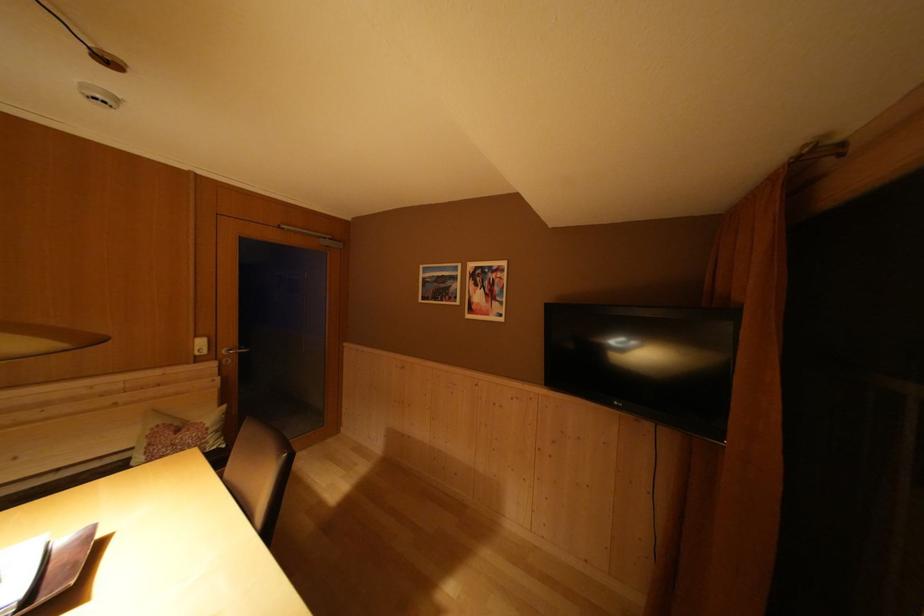
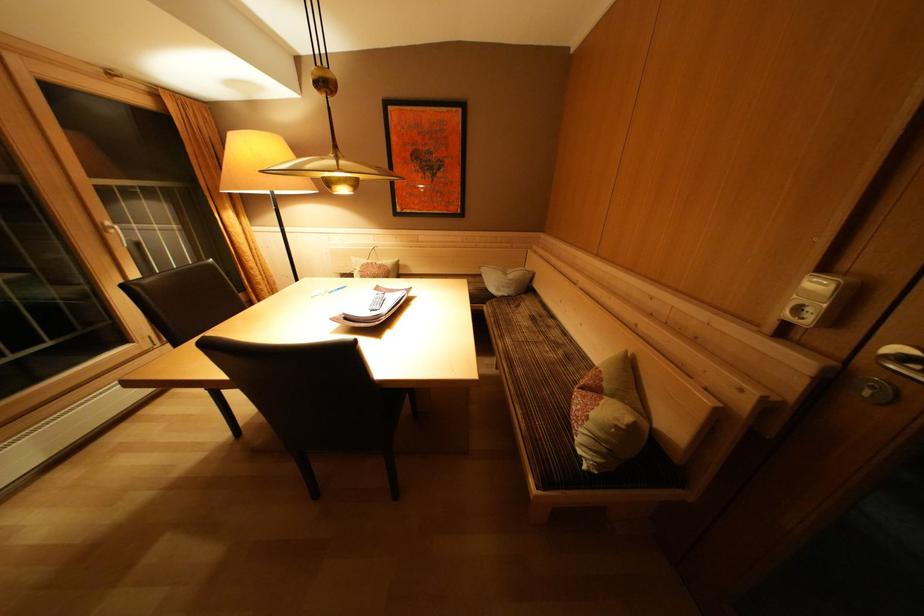
Locate, in the second image, the point that corresponds to point 213,357 in the first image.

(815, 326)